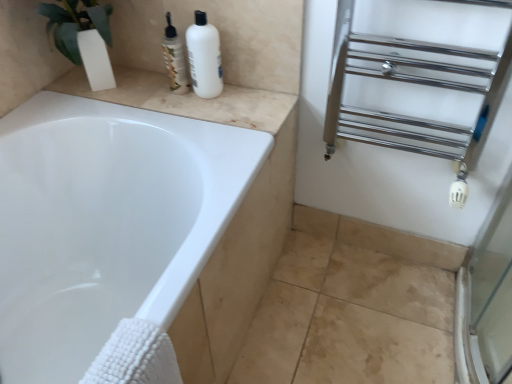
Looking at this image, measure the distance between translucent plastic bottles at upper center and camera.

A distance of 3.79 feet exists between translucent plastic bottles at upper center and camera.

Describe the element at coordinates (185, 99) in the screenshot. I see `beige marble counter top at upper left` at that location.

Identify the location of beige marble counter top at upper left. The height and width of the screenshot is (384, 512). (185, 99).

Measure the distance between point (452, 84) and camera.

They are 1.05 meters apart.

This screenshot has height=384, width=512. I want to click on white matte bottle at upper center, so click(x=204, y=57).

Can you tell me how much chrome/metal towel rack at right and beige marble counter top at upper left differ in facing direction?

chrome/metal towel rack at right and beige marble counter top at upper left are facing 1.02 degrees away from each other.

Find the location of a particular element. counter top to the left of chrome/metal towel rack at right is located at coordinates pyautogui.click(x=185, y=99).

Is chrome/metal towel rack at right facing away from beige marble counter top at upper left?

No, beige marble counter top at upper left is not at the back of chrome/metal towel rack at right.

From a real-world perspective, which object rests below the other?

beige marble counter top at upper left.

Considering the relative sizes of beige marble counter top at upper left and chrome/metal towel rack at right in the image provided, is beige marble counter top at upper left taller than chrome/metal towel rack at right?

No, beige marble counter top at upper left is not taller than chrome/metal towel rack at right.

Between beige marble counter top at upper left and chrome/metal towel rack at right, which one is positioned in front?

chrome/metal towel rack at right.

Does beige marble counter top at upper left have a lesser width compared to chrome/metal towel rack at right?

Incorrect, the width of beige marble counter top at upper left is not less than that of chrome/metal towel rack at right.

Between beige marble counter top at upper left and chrome/metal towel rack at right, which one appears on the right side from the viewer's perspective?

Positioned to the right is chrome/metal towel rack at right.

From the image's perspective, is chrome/metal towel rack at right above or below translucent plastic bottles at upper center?

From the image's perspective, chrome/metal towel rack at right appears below translucent plastic bottles at upper center.

Is chrome/metal towel rack at right far away from translucent plastic bottles at upper center?

No, chrome/metal towel rack at right is not far away from translucent plastic bottles at upper center.

Is chrome/metal towel rack at right in front of or behind translucent plastic bottles at upper center in the image?

chrome/metal towel rack at right is in front of translucent plastic bottles at upper center.

Can you confirm if chrome/metal towel rack at right is bigger than translucent plastic bottles at upper center?

Correct, chrome/metal towel rack at right is larger in size than translucent plastic bottles at upper center.

Is chrome/metal towel rack at right positioned with its back to white matte bottle at upper center?

That's not correct — chrome/metal towel rack at right is not looking away from white matte bottle at upper center.

In the scene shown: From the image's perspective, who appears lower, chrome/metal towel rack at right or white matte bottle at upper center?

chrome/metal towel rack at right.

How many degrees apart are the facing directions of chrome/metal towel rack at right and white matte bottle at upper center?

The angle between the facing direction of chrome/metal towel rack at right and the facing direction of white matte bottle at upper center is 0.786 degrees.

In the scene shown: In the image, is chrome/metal towel rack at right positioned in front of or behind white matte bottle at upper center?

chrome/metal towel rack at right is positioned closer to the viewer than white matte bottle at upper center.

From their relative heights in the image, would you say beige marble counter top at upper left is taller or shorter than white matte bottle at upper center?

beige marble counter top at upper left is shorter than white matte bottle at upper center.

Which object is closer to the camera taking this photo, beige marble counter top at upper left or white matte bottle at upper center?

Positioned in front is white matte bottle at upper center.

Is beige marble counter top at upper left oriented towards white matte bottle at upper center?

No, beige marble counter top at upper left is not aimed at white matte bottle at upper center.

This screenshot has height=384, width=512. I want to click on counter top lying behind the white matte bottle at upper center, so [x=185, y=99].

Is white matte bottle at upper center to the left or to the right of chrome/metal towel rack at right in the image?

Clearly, white matte bottle at upper center is on the left of chrome/metal towel rack at right in the image.

Would you consider white matte bottle at upper center to be distant from chrome/metal towel rack at right?

No, white matte bottle at upper center is not far from chrome/metal towel rack at right.

Can you confirm if white matte bottle at upper center is wider than chrome/metal towel rack at right?

No, white matte bottle at upper center is not wider than chrome/metal towel rack at right.

How many degrees apart are the facing directions of white matte bottle at upper center and chrome/metal towel rack at right?

0.786 degrees.

Is translucent plastic bottles at upper center beside white matte bottle at upper center?

Yes, the surface of translucent plastic bottles at upper center is in contact with white matte bottle at upper center.

From the image's perspective, which one is positioned higher, translucent plastic bottles at upper center or white matte bottle at upper center?

From the image's view, translucent plastic bottles at upper center is above.

Which is behind, translucent plastic bottles at upper center or white matte bottle at upper center?

translucent plastic bottles at upper center is further away from the camera.

Looking at this image, considering the relative sizes of translucent plastic bottles at upper center and white matte bottle at upper center in the image provided, is translucent plastic bottles at upper center smaller than white matte bottle at upper center?

Correct, translucent plastic bottles at upper center occupies less space than white matte bottle at upper center.

The image size is (512, 384). What are the coordinates of `shelf located above the beige marble counter top at upper left (from a real-world perspective)` in the screenshot? It's located at (419, 75).

Find the location of a particular element. Image resolution: width=512 pixels, height=384 pixels. counter top below the chrome/metal towel rack at right (from a real-world perspective) is located at coordinates (185, 99).

Which object lies further to the anchor point beige marble counter top at upper left, translucent plastic bottles at upper center or white matte bottle at upper center?

The object further to beige marble counter top at upper left is white matte bottle at upper center.

From the image, which object appears to be farther from white matte bottle at upper center, beige marble counter top at upper left or chrome/metal towel rack at right?

chrome/metal towel rack at right is further to white matte bottle at upper center.

Looking at the image, which one is located closer to translucent plastic bottles at upper center, beige marble counter top at upper left or chrome/metal towel rack at right?

beige marble counter top at upper left is closer to translucent plastic bottles at upper center.

Consider the image. From the image, which object appears to be nearer to translucent plastic bottles at upper center, chrome/metal towel rack at right or white matte bottle at upper center?

white matte bottle at upper center is closer to translucent plastic bottles at upper center.

Considering their positions, is beige marble counter top at upper left positioned closer to translucent plastic bottles at upper center than white matte bottle at upper center?

white matte bottle at upper center lies closer to translucent plastic bottles at upper center than the other object.

From the image, which object appears to be nearer to beige marble counter top at upper left, chrome/metal towel rack at right or white matte bottle at upper center?

white matte bottle at upper center is positioned closer to the anchor beige marble counter top at upper left.

From the image, which object appears to be farther from beige marble counter top at upper left, white matte bottle at upper center or translucent plastic bottles at upper center?

Among the two, white matte bottle at upper center is located further to beige marble counter top at upper left.

When comparing their distances from beige marble counter top at upper left, does chrome/metal towel rack at right or translucent plastic bottles at upper center seem closer?

The object closer to beige marble counter top at upper left is translucent plastic bottles at upper center.

You are a GUI agent. You are given a task and a screenshot of the screen. Output one action in this format:
    pyautogui.click(x=<x>, y=<y>)
    Task: Click on the cleaning product located between beige marble counter top at upper left and chrome/metal towel rack at right in the left-right direction
    The width and height of the screenshot is (512, 384).
    Given the screenshot: What is the action you would take?
    pyautogui.click(x=204, y=57)

I want to click on toiletry located between beige marble counter top at upper left and chrome/metal towel rack at right in the left-right direction, so click(174, 59).

At what (x,y) coordinates should I click in order to perform the action: click on toiletry located between beige marble counter top at upper left and white matte bottle at upper center in the left-right direction. Please return your answer as a coordinate pair (x, y). Image resolution: width=512 pixels, height=384 pixels. Looking at the image, I should click on (174, 59).

Where is `cleaning product situated between translucent plastic bottles at upper center and chrome/metal towel rack at right from left to right`? cleaning product situated between translucent plastic bottles at upper center and chrome/metal towel rack at right from left to right is located at coordinates (204, 57).